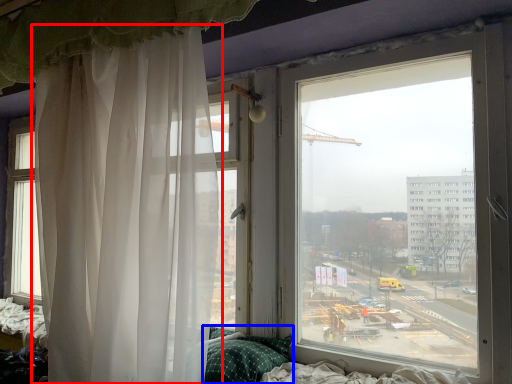
Question: Which of the following is the farthest to the observer, curtain (highlighted by a red box) or pillow (highlighted by a blue box)?

Choices:
 (A) curtain
 (B) pillow

Answer: (B)